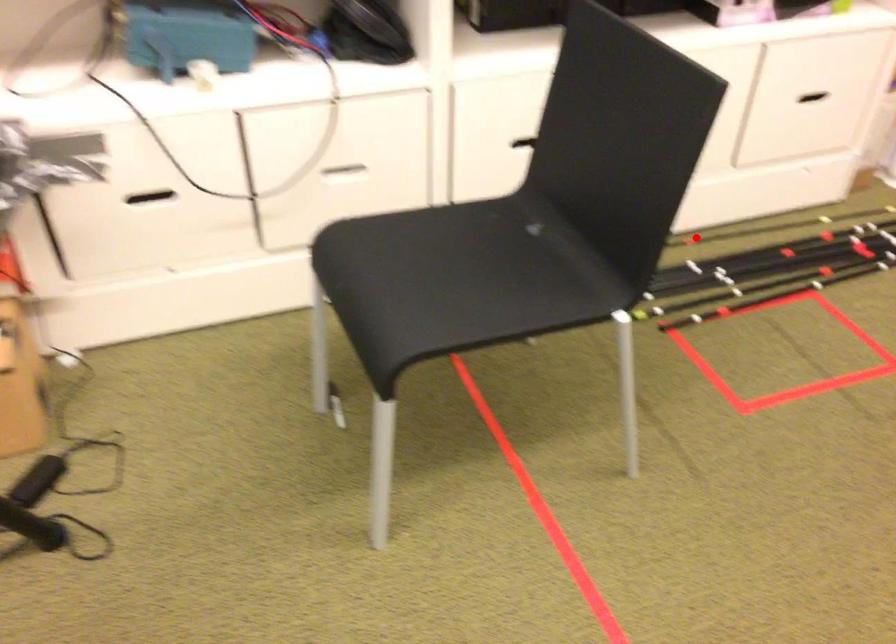
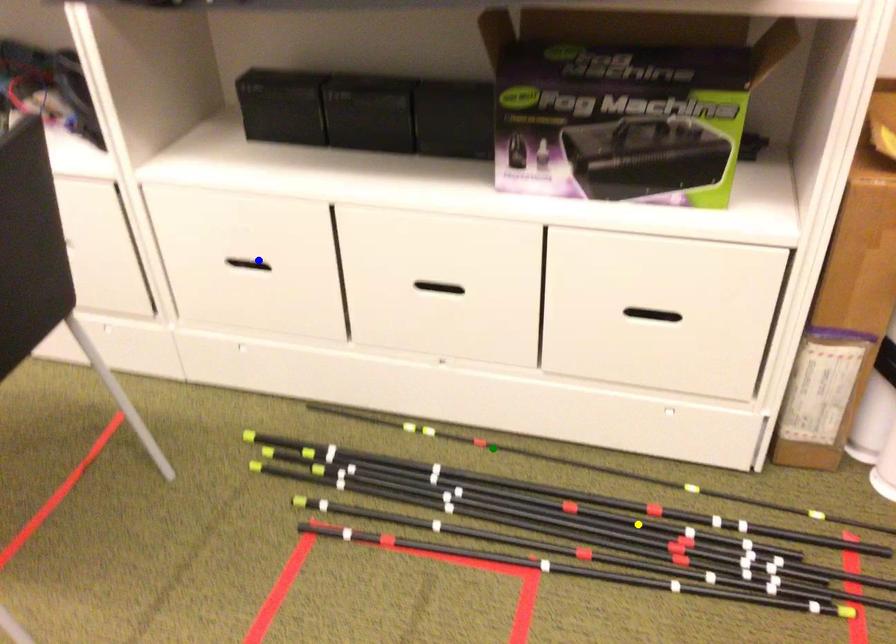
Question: I am providing you with two images of the same scene from different viewpoints. A red point is marked on the first image. You are given multiple points on the second image. Can you choose the point in image 2 that corresponds to the point in image 1?

Choices:
 (A) yellow point
 (B) green point
 (C) blue point

Answer: (B)